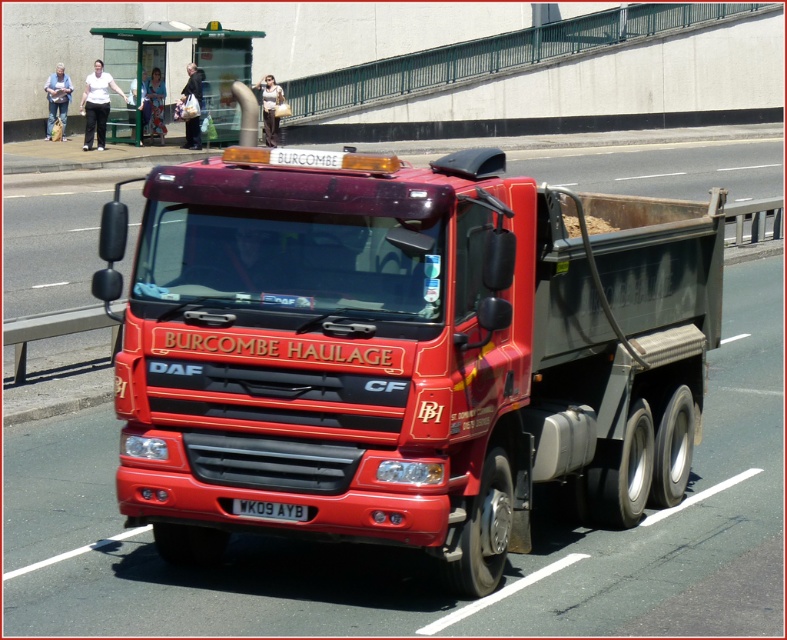
Is matte red truck at center taller than black plastic license plate at center?

Indeed, matte red truck at center has a greater height compared to black plastic license plate at center.

Describe the element at coordinates (405, 353) in the screenshot. I see `matte red truck at center` at that location.

Find the location of a particular element. matte red truck at center is located at coordinates (405, 353).